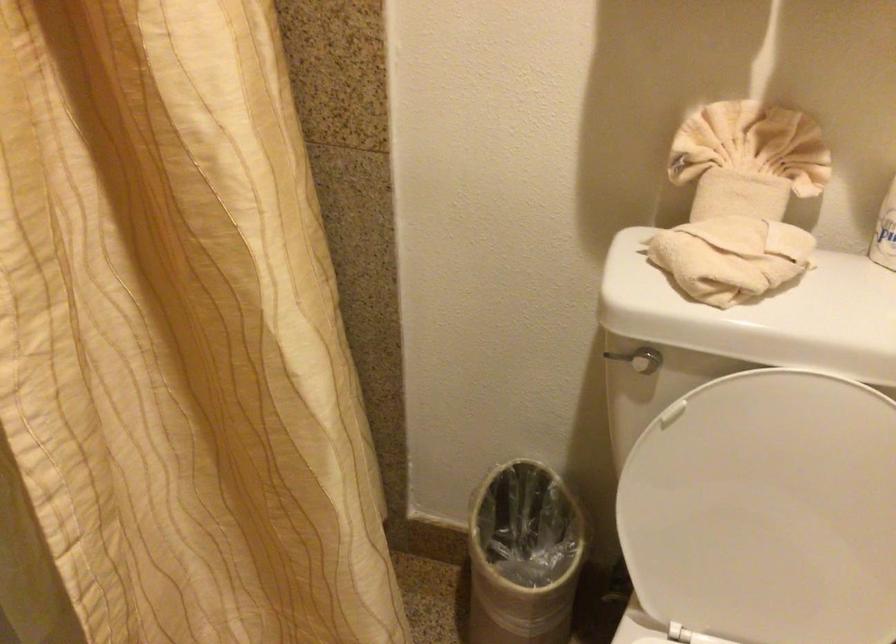
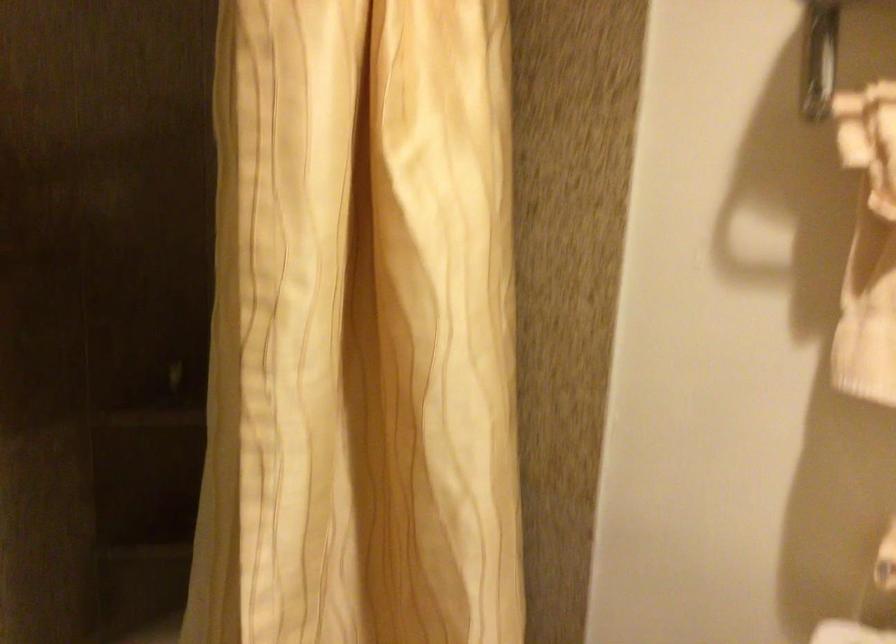
Question: In a continuous first-person perspective shot, in which direction is the camera moving?

Choices:
 (A) Left
 (B) Right
 (C) Forward
 (D) Backward

Answer: (D)